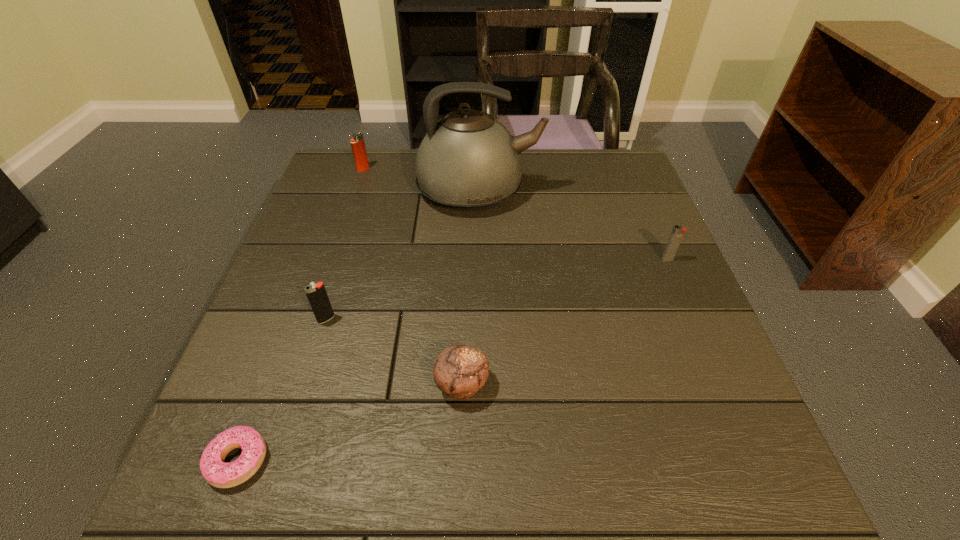
Identify which igniter is the nearest to the nearest igniter. Please provide its 2D coordinates. Your answer should be formatted as a tuple, i.e. [(x, y)], where the tuple contains the x and y coordinates of a point satisfying the conditions above.

[(357, 142)]

Identify which igniter is the second closest to the nearest igniter. Please provide its 2D coordinates. Your answer should be formatted as a tuple, i.e. [(x, y)], where the tuple contains the x and y coordinates of a point satisfying the conditions above.

[(678, 231)]

Locate an element on the screen. The image size is (960, 540). free location that satisfies the following two spatial constraints: 1. on the back side of the doughnut; 2. on the right side of the farthest igniter is located at coordinates (x=348, y=169).

This screenshot has width=960, height=540. Find the location of `free location that satisfies the following two spatial constraints: 1. at the spout of the kettle; 2. on the right side of the rightmost object`. free location that satisfies the following two spatial constraints: 1. at the spout of the kettle; 2. on the right side of the rightmost object is located at coordinates (479, 259).

This screenshot has width=960, height=540. Identify the location of free space that satisfies the following two spatial constraints: 1. on the back side of the shortest object; 2. on the left side of the nearest igniter. click(292, 319).

Find the location of a particular element. Image resolution: width=960 pixels, height=540 pixels. free space that satisfies the following two spatial constraints: 1. on the front side of the third nearest object; 2. on the left side of the farthest igniter is located at coordinates (313, 319).

In order to click on blank space that satisfies the following two spatial constraints: 1. at the spout of the rightmost object; 2. on the right side of the kettle in this screenshot , I will do `click(479, 259)`.